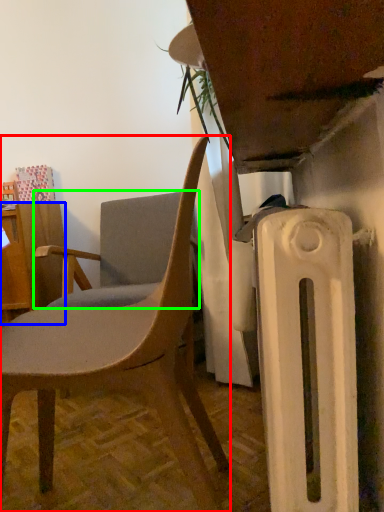
Question: Which object is positioned closest to chair (highlighted by a red box)? Select from desk (highlighted by a blue box) and chair (highlighted by a green box).

Choices:
 (A) desk
 (B) chair

Answer: (B)